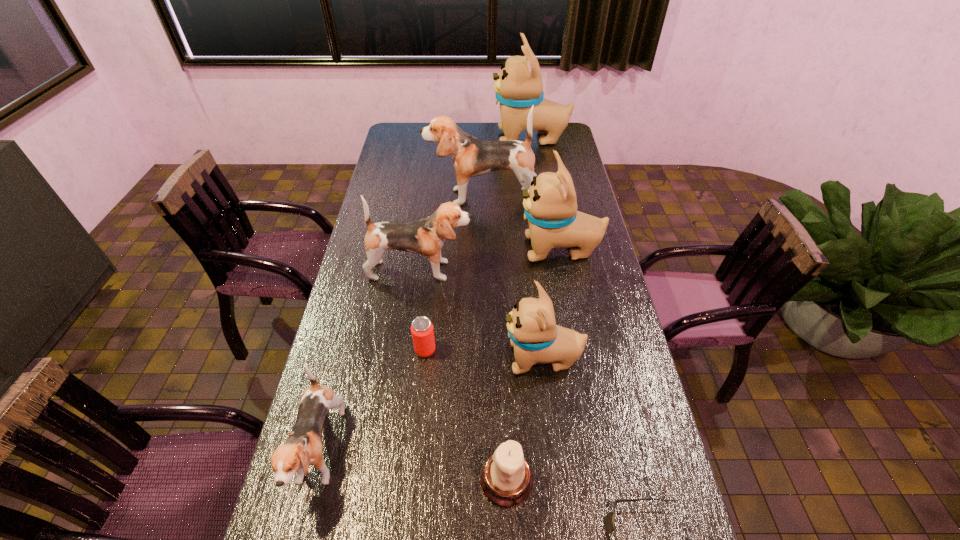
Find the location of a particular element. vacant space located 0.310m on the face of the second smallest beige puppy is located at coordinates (432, 249).

The width and height of the screenshot is (960, 540). What are the coordinates of `vacant space located on the face of the second smallest beige puppy` in the screenshot? It's located at (493, 249).

Where is `free space located on the face of the second smallest beige puppy`? The width and height of the screenshot is (960, 540). free space located on the face of the second smallest beige puppy is located at coordinates (474, 249).

This screenshot has width=960, height=540. I want to click on blank space located at the face of the second smallest brown puppy, so click(534, 270).

I want to click on vacant space located on the face of the smallest beige puppy, so (x=413, y=358).

Identify the location of vacant space located 0.160m on the face of the smallest beige puppy. The width and height of the screenshot is (960, 540). (448, 358).

The height and width of the screenshot is (540, 960). I want to click on free space located 0.100m on the face of the smallest beige puppy, so click(468, 358).

Locate an element on the screen. The image size is (960, 540). free location located on the front of the candle holder is located at coordinates (509, 534).

This screenshot has height=540, width=960. Identify the location of free location located 0.390m on the back of the beer can. point(436,252).

The width and height of the screenshot is (960, 540). In order to click on object located in the far edge section of the desktop in this screenshot , I will do `click(518, 87)`.